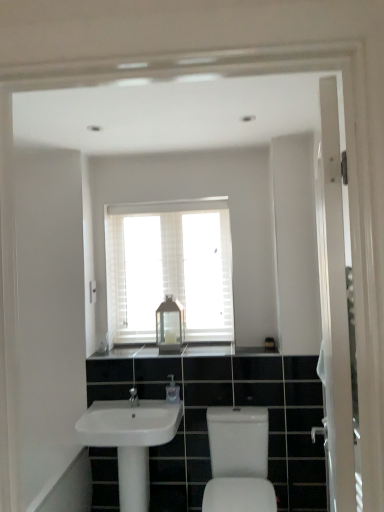
Where is `free space above black granite countertop at center (from a real-world perspective)`? The height and width of the screenshot is (512, 384). free space above black granite countertop at center (from a real-world perspective) is located at coordinates (166, 346).